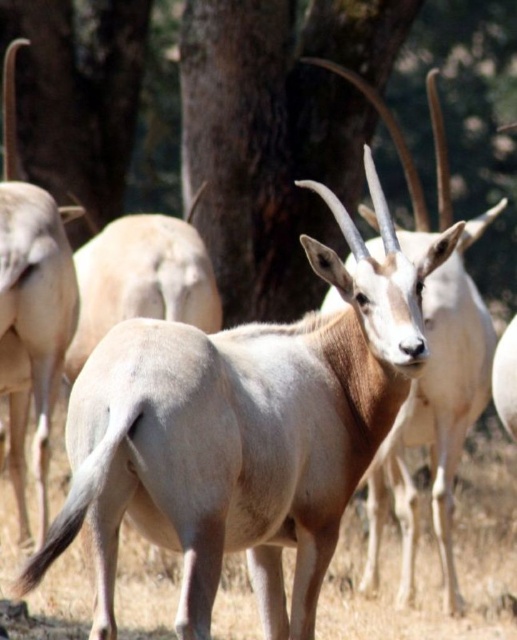
You are a photographer trying to capture a photo of the light brown fur antelope at center and the brown rough tree at center. From your current position, which one is positioned to the left?

The brown rough tree at center is positioned to the left of the light brown fur antelope at center, so the brown rough tree at center is the one on the left.

You are an animal researcher observing the oryx herd in the image. You notice two brown rough trees in the background. Which one, the brown rough tree at center or the brown rough tree trunk at upper center, is taller?

The brown rough tree at center is taller than the brown rough tree trunk at upper center.

You are a wildlife photographer aiming to capture a clear photo of the light brown fur antelope at center and the brown rough tree trunk at upper center. Which object will appear closer to the camera lens in your photo?

The light brown fur antelope at center will appear closer to the camera lens because it is positioned in front of the brown rough tree trunk at upper center.